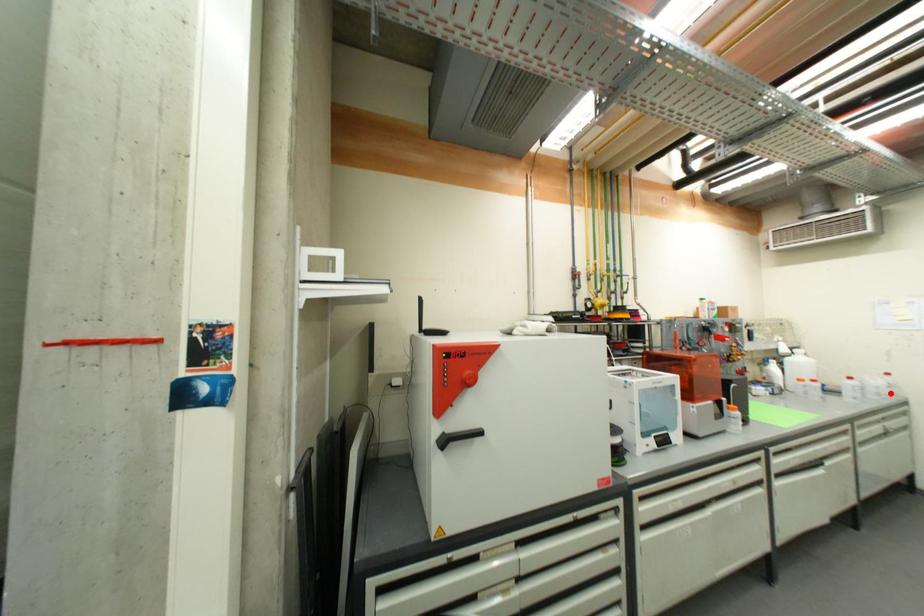
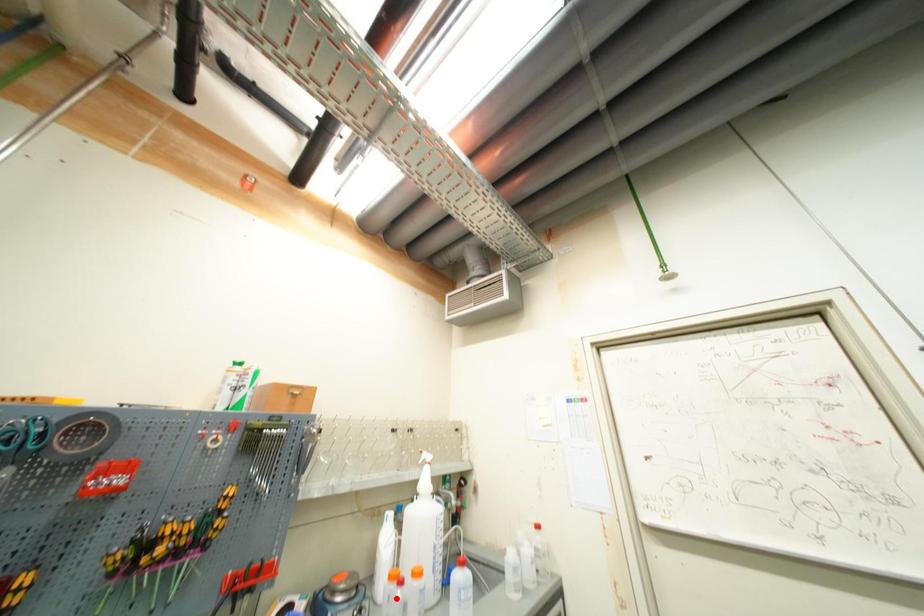
I am providing you with two images of the same scene from different viewpoints. A red point is marked on the first image and another point is marked on the second image. Are the points marked in image1 and image2 representing the same 3D position?

No